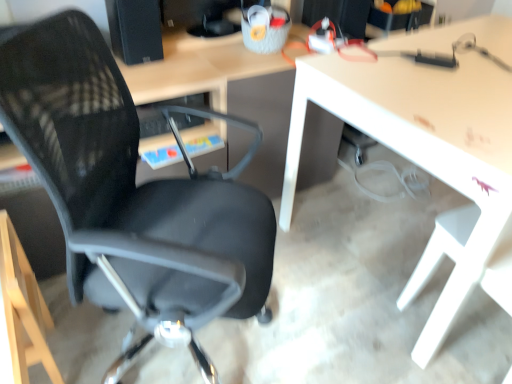
Identify the location of vacant region to the right of black mesh chair at left. The height and width of the screenshot is (384, 512). click(321, 325).